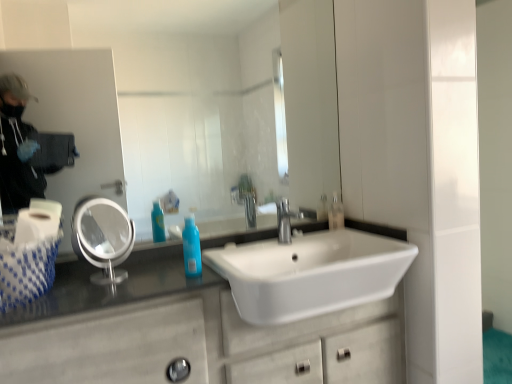
Question: Is the depth of blue glossy bottle at center less than that of white woven tissue at left?

Choices:
 (A) yes
 (B) no

Answer: (B)

Question: Considering the relative positions of blue glossy bottle at center and white woven tissue at left in the image provided, is blue glossy bottle at center to the right of white woven tissue at left from the viewer's perspective?

Choices:
 (A) yes
 (B) no

Answer: (A)

Question: Can you confirm if blue glossy bottle at center is smaller than white woven tissue at left?

Choices:
 (A) no
 (B) yes

Answer: (B)

Question: Is blue glossy bottle at center at the left side of white woven tissue at left?

Choices:
 (A) no
 (B) yes

Answer: (A)

Question: Could you tell me if blue glossy bottle at center is turned towards white woven tissue at left?

Choices:
 (A) yes
 (B) no

Answer: (B)

Question: Is white marble bathroom cabinet at lower left situated inside silver metallic faucet at center or outside?

Choices:
 (A) outside
 (B) inside

Answer: (A)

Question: In terms of height, does white marble bathroom cabinet at lower left look taller or shorter compared to silver metallic faucet at center?

Choices:
 (A) short
 (B) tall

Answer: (B)

Question: In terms of size, does white marble bathroom cabinet at lower left appear bigger or smaller than silver metallic faucet at center?

Choices:
 (A) big
 (B) small

Answer: (A)

Question: Is point (146, 296) closer or farther from the camera than point (278, 221)?

Choices:
 (A) closer
 (B) farther

Answer: (A)

Question: From their relative heights in the image, would you say white glossy mirror at upper center, the first mirror in the right-to-left sequence, is taller or shorter than translucent plastic soap dispenser at upper right?

Choices:
 (A) short
 (B) tall

Answer: (B)

Question: From the image's perspective, relative to translucent plastic soap dispenser at upper right, is white glossy mirror at upper center, which is the 2th mirror in left-to-right order, above or below?

Choices:
 (A) below
 (B) above

Answer: (B)

Question: Does point (34, 81) appear closer or farther from the camera than point (330, 210)?

Choices:
 (A) farther
 (B) closer

Answer: (A)

Question: Would you say white glossy mirror at upper center, the first mirror in the right-to-left sequence, is to the left or to the right of translucent plastic soap dispenser at upper right in the picture?

Choices:
 (A) left
 (B) right

Answer: (A)

Question: Does point (78, 142) appear closer or farther from the camera than point (26, 228)?

Choices:
 (A) farther
 (B) closer

Answer: (A)

Question: From the image's perspective, relative to white woven tissue at left, is white glossy mirror at upper center, which is the 2th mirror in left-to-right order, above or below?

Choices:
 (A) below
 (B) above

Answer: (B)